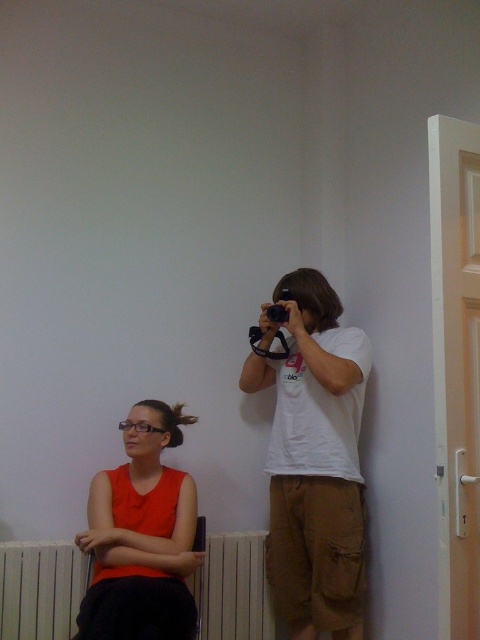
Question: Can you confirm if white cotton t-shirt at center is positioned to the right of white metallic radiator at lower left?

Choices:
 (A) yes
 (B) no

Answer: (A)

Question: Among these objects, which one is nearest to the camera?

Choices:
 (A) white cotton t-shirt at center
 (B) matte orange top at lower left
 (C) black plastic camera at upper center
 (D) white metallic radiator at lower left

Answer: (B)

Question: Among these points, which one is farthest from the camera?

Choices:
 (A) click(x=322, y=547)
 (B) click(x=143, y=532)
 (C) click(x=283, y=321)

Answer: (C)

Question: Among these points, which one is nearest to the camera?

Choices:
 (A) (292, 280)
 (B) (290, 298)

Answer: (B)

Question: Can you confirm if white cotton t-shirt at center is thinner than white metallic radiator at lower left?

Choices:
 (A) no
 (B) yes

Answer: (A)

Question: Does white metallic radiator at lower left appear over black plastic camera at upper center?

Choices:
 (A) yes
 (B) no

Answer: (B)